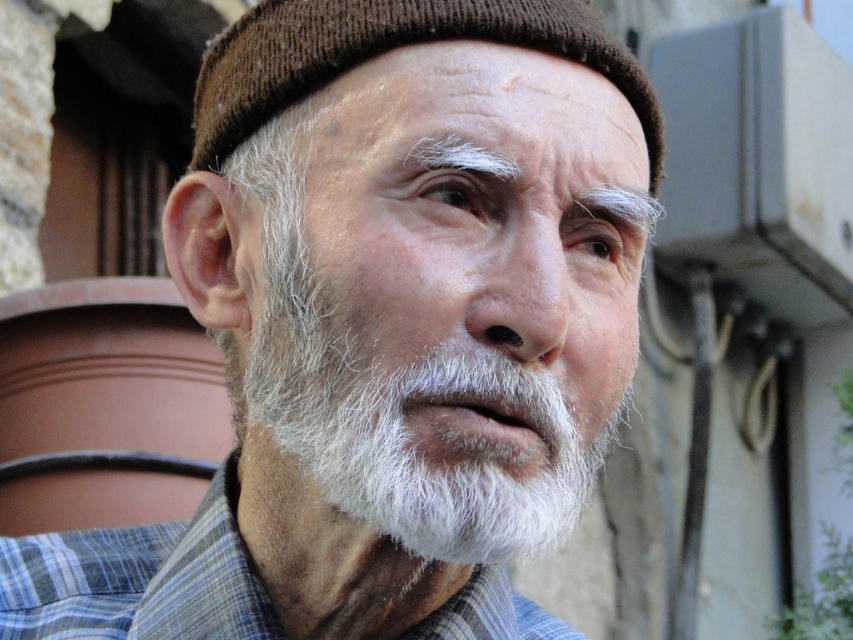
You are an artist sketching this portrait. You need to draw the white matte beard at center and the blue plaid shirt at center. According to the scene, which object should you draw first if you follow the standard left to right drawing technique?

The blue plaid shirt at center should be drawn first since it is positioned to the left of the white matte beard at center, following the left to right drawing technique.

You are an artist trying to sketch this portrait. You need to decide which object to draw first based on their size. Which one should you start with, the blue plaid shirt at center or the brown knitted hat at upper center?

The blue plaid shirt at center has a lesser width compared to the brown knitted hat at upper center, so you should start with the brown knitted hat at upper center since it is wider and might require more space in the composition.

You are an artist sketching this portrait. You need to draw the white matte beard at center and the brown knitted hat at upper center. Which object should you draw first if you want to follow the correct spatial order from top to bottom?

You should draw the brown knitted hat at upper center first because it is positioned above the white matte beard at center.